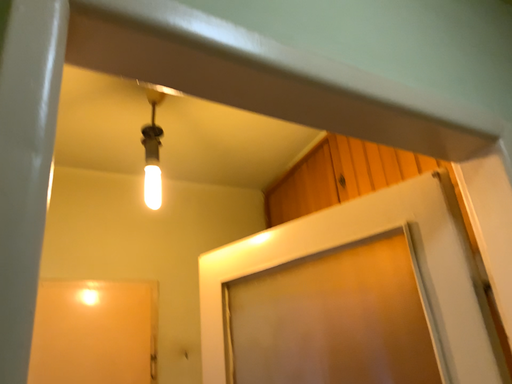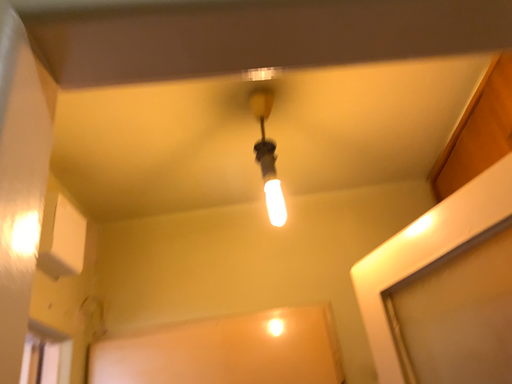
Question: Which way did the camera rotate in the video?

Choices:
 (A) rotated right
 (B) rotated left

Answer: (B)